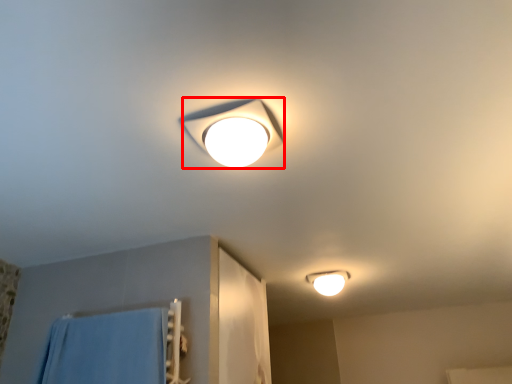
Question: In this image, where is lamp (annotated by the red box) located relative to lamp?

Choices:
 (A) left
 (B) right

Answer: (A)